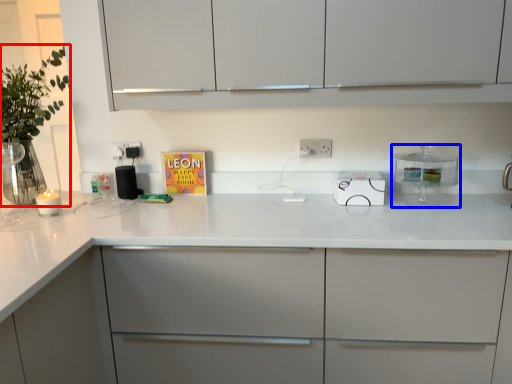
Question: Which object is closer to the camera taking this photo, plant (highlighted by a red box) or kitchen appliance (highlighted by a blue box)?

Choices:
 (A) plant
 (B) kitchen appliance

Answer: (A)